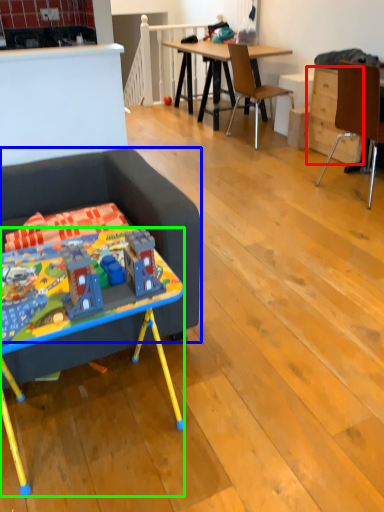
Question: Based on their relative distances, which object is farther from drawer (highlighted by a red box)? Choose from studio couch (highlighted by a blue box) and desk (highlighted by a green box).

Choices:
 (A) studio couch
 (B) desk

Answer: (B)